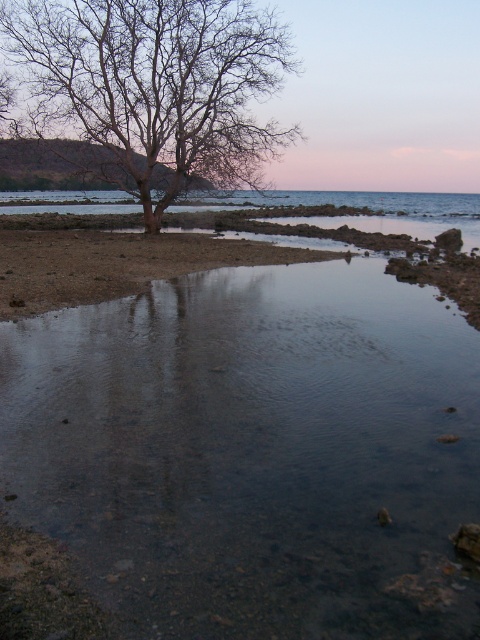
You are standing at the edge of the water and want to take a photo of the clear water at center and the bare wood tree at upper left. Which object will appear larger in the photo?

The clear water at center will appear larger in the photo because it is closer to the camera than the bare wood tree at upper left.

You are standing at the edge of the water in the coastal scene. You want to walk to the point marked as point [253,452]. Is the ground at that point solid or is it covered with water?

The point [253,452] is covered with clear water at center, so the ground there is not solid and walking there would involve wading through water.

Based on the photo, you are an artist wanting to paint the scene. You have a canvas that can only fit objects with a width of 10 cm or less. You see the clear water at center and the bare wood tree at upper left. Which object can you paint on your canvas without resizing?

The clear water at center is thinner than the bare wood tree at upper left, so the clear water at center can be painted on the canvas without resizing since it is narrower than 10 cm.